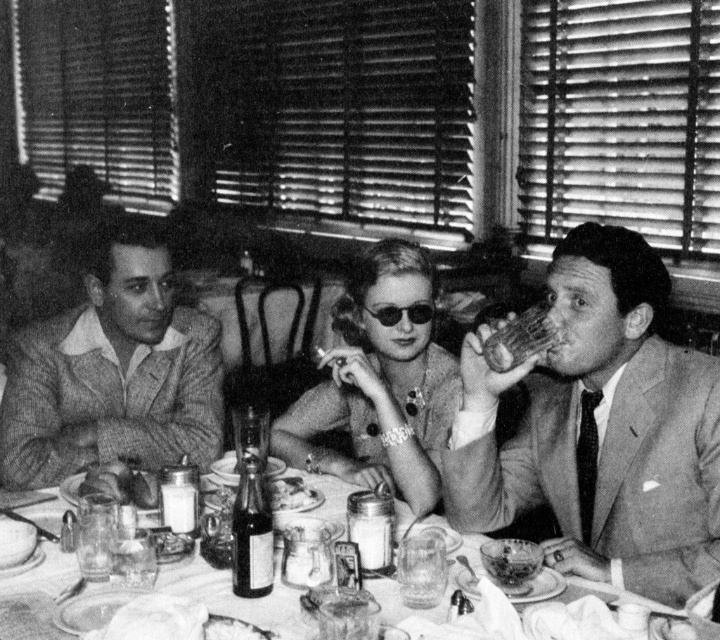
Question: Is smooth leather jacket at right to the left of textured wool sweater at left from the viewer's perspective?

Choices:
 (A) yes
 (B) no

Answer: (B)

Question: Does smooth glass plate at center lie in front of wooden cup at right?

Choices:
 (A) yes
 (B) no

Answer: (A)

Question: Does textured wool sweater at left appear over smooth glass plate at center?

Choices:
 (A) no
 (B) yes

Answer: (B)

Question: Which point is closer to the camera?

Choices:
 (A) textured wool sweater at left
 (B) shiny black sunglasses at center

Answer: (A)

Question: Among these objects, which one is nearest to the camera?

Choices:
 (A) wooden cup at right
 (B) smooth white bread at center
 (C) smooth brown bread at center

Answer: (A)

Question: Which object appears closest to the camera in this image?

Choices:
 (A) textured wool sweater at left
 (B) shiny black sunglasses at center
 (C) smooth glass plate at center
 (D) translucent glass bottle at center

Answer: (C)